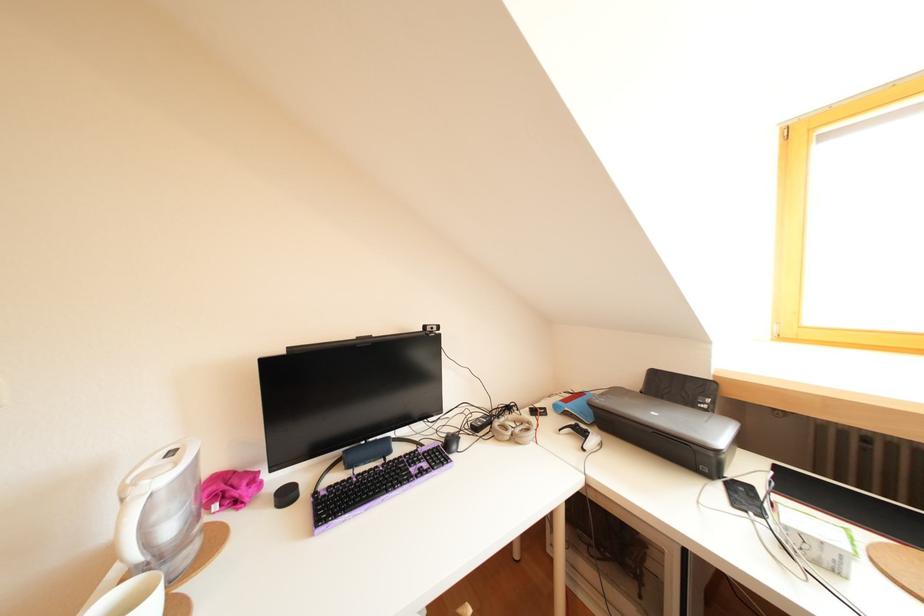
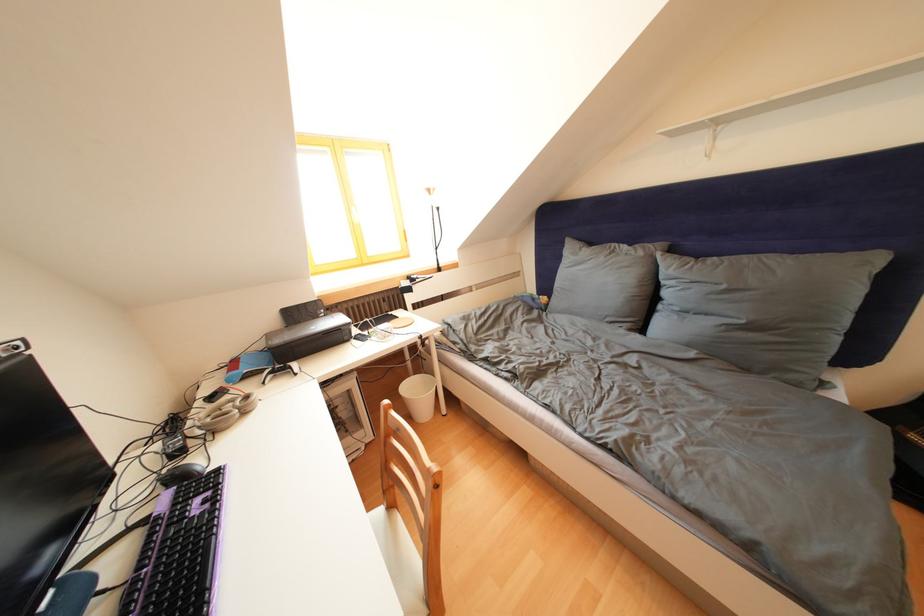
Where in the second image is the point corresponding to the point at 699,407 from the first image?

(323, 322)